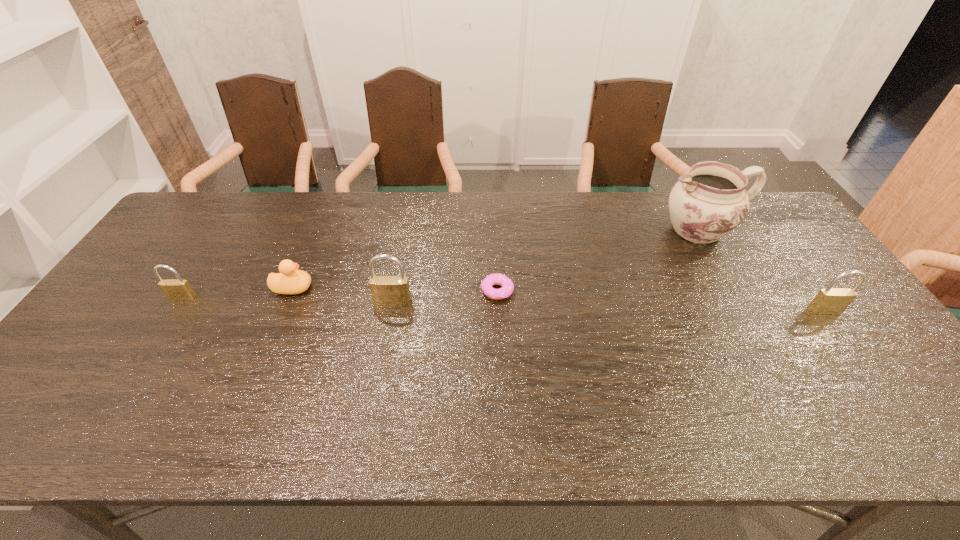
To make them evenly spaced by inserting another padlock among them, please locate a vacant spot for this new padlock. Please provide its 2D coordinates. Your answer should be formatted as a tuple, i.e. [(x, y)], where the tuple contains the x and y coordinates of a point satisfying the conditions above.

[(607, 306)]